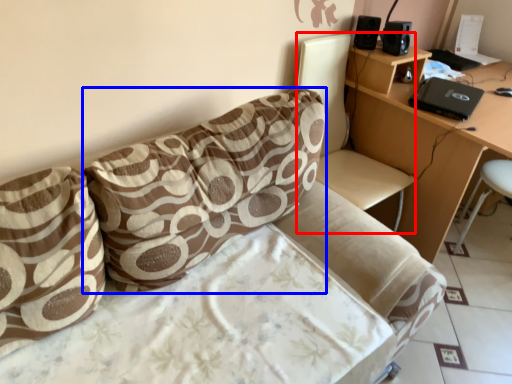
Question: Which point is further to the camera, swivel chair (highlighted by a red box) or pillow (highlighted by a blue box)?

Choices:
 (A) swivel chair
 (B) pillow

Answer: (A)